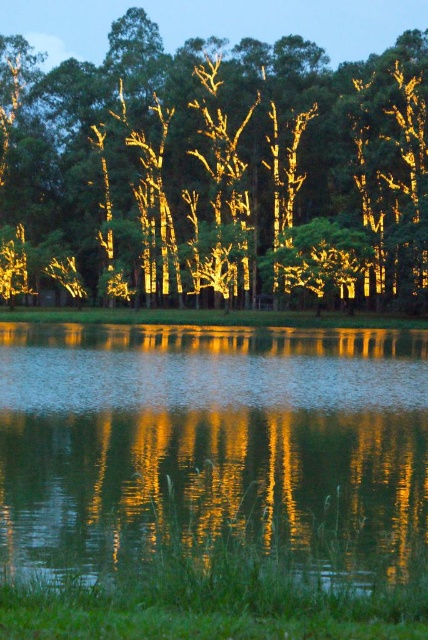
You are standing on the grassy bank and want to take a photo of the illuminated bark tree at center and its reflection in the glistening reflective water at bottom. Which object should you focus on first to capture both the tree and its reflection clearly?

You should focus on the illuminated bark tree at center first because it is positioned over the glistening reflective water at bottom, ensuring that capturing the tree will naturally include its reflection in the water below.

You are standing at the edge of the glistening reflective water at bottom and want to take a photo of the illuminated bark tree at center. Will the tree be fully visible in the reflection of the water?

The illuminated bark tree at center is taller than the glistening reflective water at bottom, so its reflection may not fully appear in the water since the water does not reach the full height of the tree.